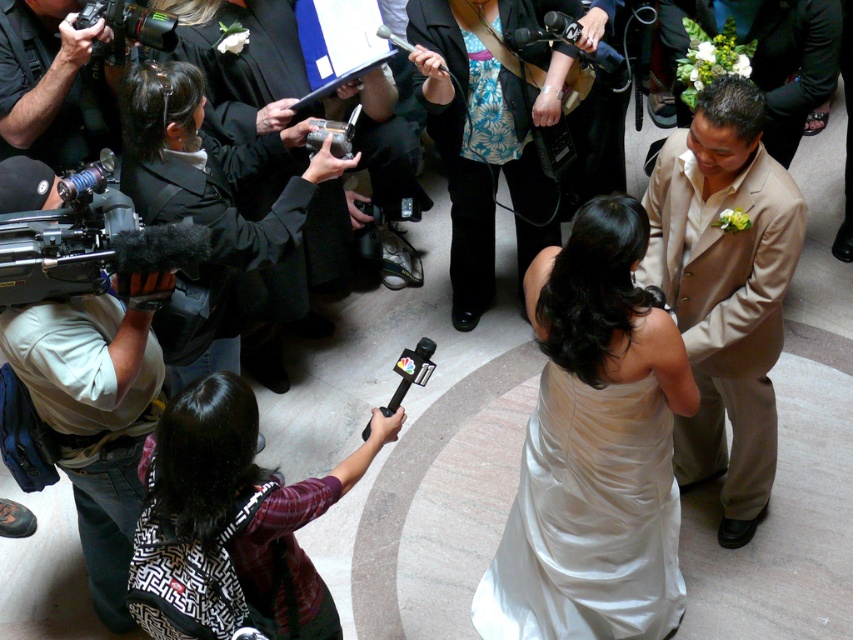
Question: Does tan satin suit at center have a larger size compared to floral print blouse at center?

Choices:
 (A) yes
 (B) no

Answer: (B)

Question: Can you confirm if satin dress at center is bigger than tan satin suit at center?

Choices:
 (A) yes
 (B) no

Answer: (B)

Question: Which point is farther from the camera taking this photo?

Choices:
 (A) (184, 416)
 (B) (500, 132)
 (C) (312, 144)

Answer: (B)

Question: Based on their relative distances, which object is nearer to the silver metallic video camera at center?

Choices:
 (A) black matte video camera at left
 (B) floral print blouse at center
 (C) tan satin suit at center

Answer: (B)

Question: Which object is the farthest from the black plastic video camera at upper left?

Choices:
 (A) plaid fabric shirt at lower left
 (B) floral print blouse at center
 (C) silver metallic video camera at center

Answer: (A)

Question: Is satin dress at center thinner than floral print blouse at center?

Choices:
 (A) yes
 (B) no

Answer: (A)